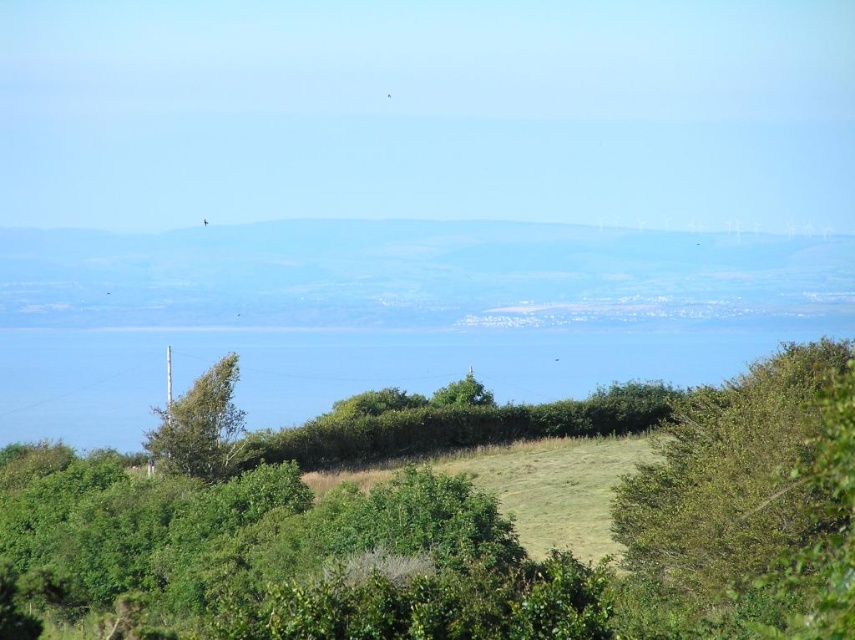
Question: Which object appears closest to the camera in this image?

Choices:
 (A) green leafy bush at lower right
 (B) green leafy tree at lower left
 (C) green grassy hill at center

Answer: (C)

Question: Which of these objects is positioned closest to the green grassy hill at center?

Choices:
 (A) green leafy tree at lower left
 (B) green leafy bush at lower right

Answer: (B)

Question: Does green grassy hill at center appear under green leafy tree at lower left?

Choices:
 (A) no
 (B) yes

Answer: (B)

Question: Considering the relative positions of green leafy bush at lower right and green leafy tree at lower left in the image provided, where is green leafy bush at lower right located with respect to green leafy tree at lower left?

Choices:
 (A) below
 (B) above

Answer: (B)

Question: Among these points, which one is farthest from the camera?

Choices:
 (A) (836, 605)
 (B) (203, 417)

Answer: (B)

Question: Is green grassy hill at center above green leafy bush at lower right?

Choices:
 (A) yes
 (B) no

Answer: (B)